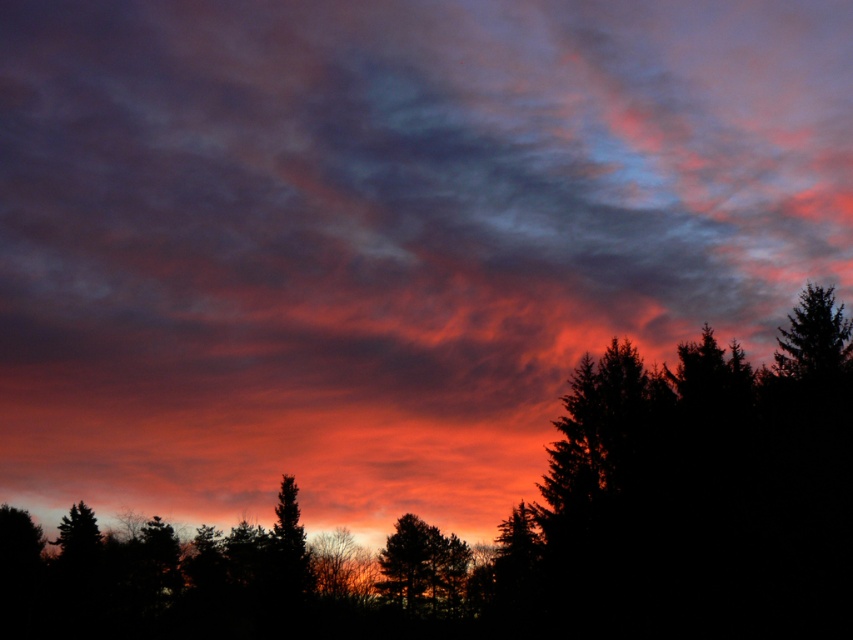
From the picture: You are an astronomer observing the sunset and want to determine the relative positions of the two trees in the image. Which tree is positioned higher in the sky between the silhouette evergreen tree at right and the silhouette tree at center?

The silhouette evergreen tree at right is positioned higher in the sky than the silhouette tree at center.

You are a photographer wanting to capture the sunset scene. You are standing at the silhouette trees at center and want to move to the silhouette evergreen tree at right to adjust your camera angle. Can you walk directly between them without needing to detour around any obstacles?

The distance between the silhouette trees at center and the silhouette evergreen tree at right is 3.72 meters, so yes, you can walk directly between them since there is enough space to move freely without needing to detour around obstacles.